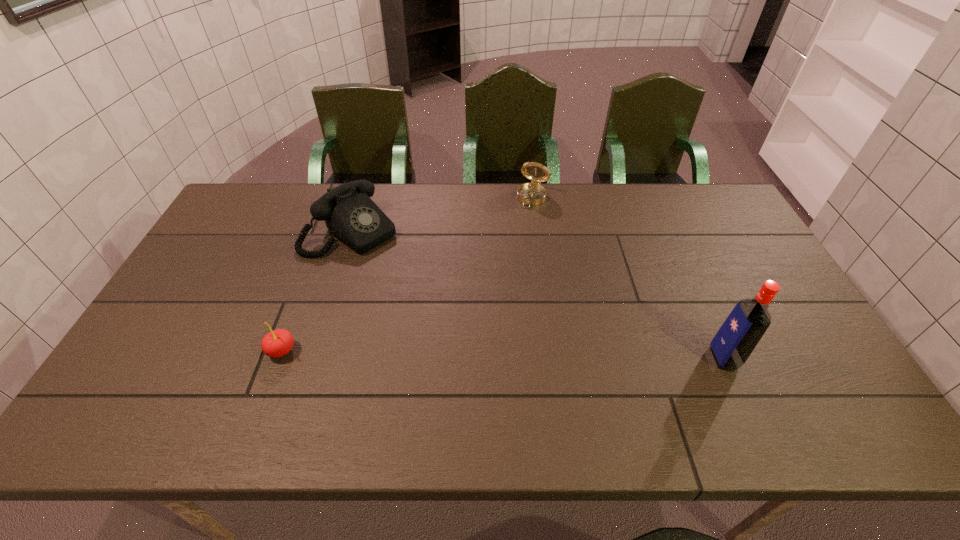
What are the coordinates of `free spot between the tallest object and the telephone` in the screenshot? It's located at (538, 294).

Identify the location of free space between the compass and the cherry. The width and height of the screenshot is (960, 540). (407, 274).

This screenshot has height=540, width=960. I want to click on vacant area that lies between the vodka and the second object from right to left, so click(628, 278).

Identify the location of vacant point located between the second object from right to left and the rightmost object. The width and height of the screenshot is (960, 540). (628, 278).

Identify the location of object that ranks as the closest to the vodka. (533, 193).

Select which object is the second closest to the vodka. Please provide its 2D coordinates. Your answer should be formatted as a tuple, i.e. [(x, y)], where the tuple contains the x and y coordinates of a point satisfying the conditions above.

[(350, 215)]

Locate an element on the screen. vacant region that satisfies the following two spatial constraints: 1. on the back side of the second object from right to left; 2. on the left side of the cherry is located at coordinates (339, 198).

You are a GUI agent. You are given a task and a screenshot of the screen. Output one action in this format:
    pyautogui.click(x=<x>, y=<y>)
    Task: Click on the free region that satisfies the following two spatial constraints: 1. on the front side of the cherry; 2. on the front and back of the tallest object
    
    Given the screenshot: What is the action you would take?
    (279, 358)

Image resolution: width=960 pixels, height=540 pixels. In order to click on vacant region that satisfies the following two spatial constraints: 1. on the front side of the telephone; 2. on the front and back of the tallest object in this screenshot , I will do `click(311, 358)`.

The width and height of the screenshot is (960, 540). Find the location of `vacant area in the image that satisfies the following two spatial constraints: 1. on the front side of the vodka; 2. on the front and back of the compass`. vacant area in the image that satisfies the following two spatial constraints: 1. on the front side of the vodka; 2. on the front and back of the compass is located at coordinates (555, 358).